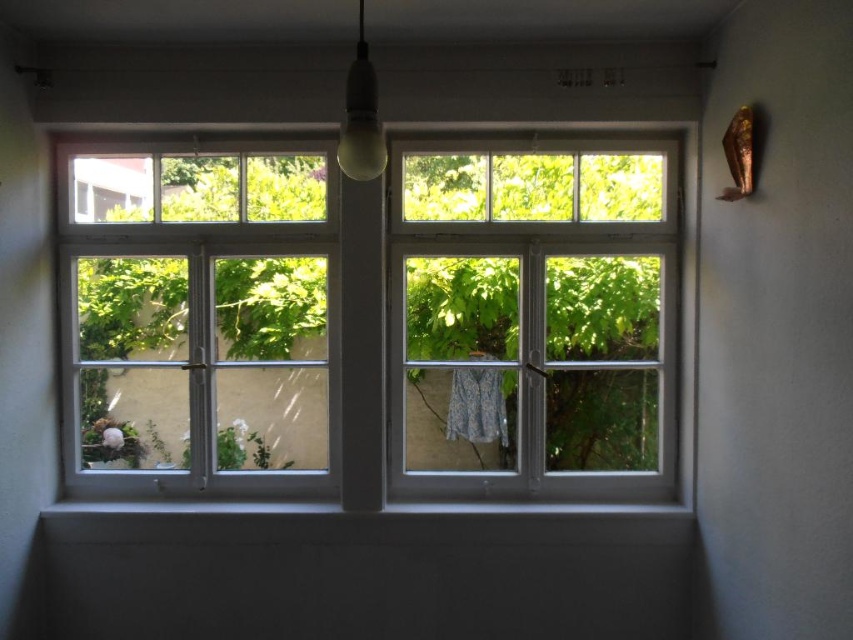
Question: Which of the following is the closest to the observer?

Choices:
 (A) clear glass window at center
 (B) white glass window at left

Answer: (B)

Question: Which object is positioned closest to the white glass window at left?

Choices:
 (A) white wooden window at center
 (B) matte glass bulb at upper center
 (C) patterned fabric curtain at center
 (D) clear glass window at center

Answer: (A)

Question: Which point is farther to the camera?

Choices:
 (A) (213, 336)
 (B) (519, 152)
 (C) (495, 376)
 (D) (341, 145)

Answer: (C)

Question: Is white glass window at left below patterned fabric curtain at center?

Choices:
 (A) no
 (B) yes

Answer: (A)

Question: Is white wooden window at center positioned at the back of white glass window at left?

Choices:
 (A) no
 (B) yes

Answer: (A)

Question: Can you confirm if white wooden window at center is bigger than clear glass window at center?

Choices:
 (A) no
 (B) yes

Answer: (B)